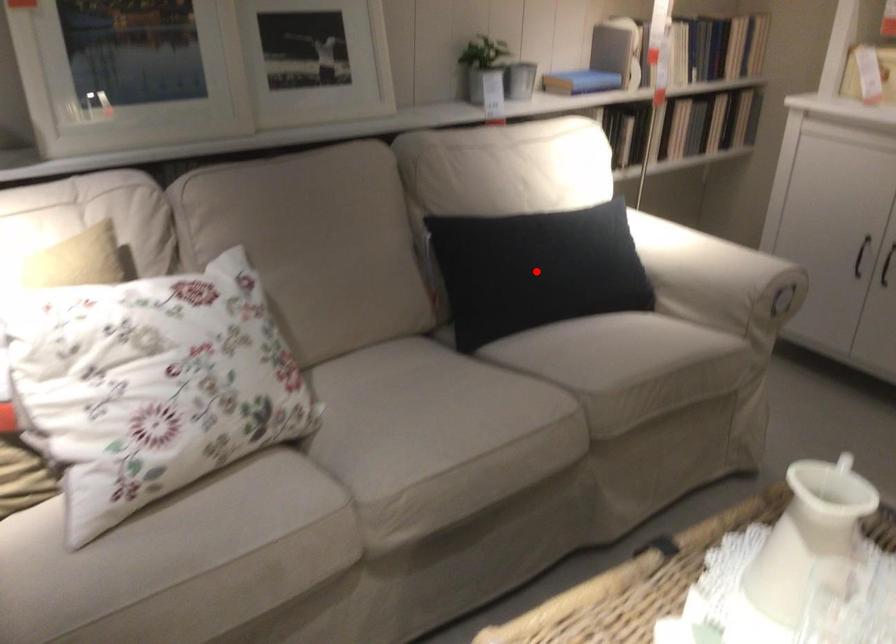
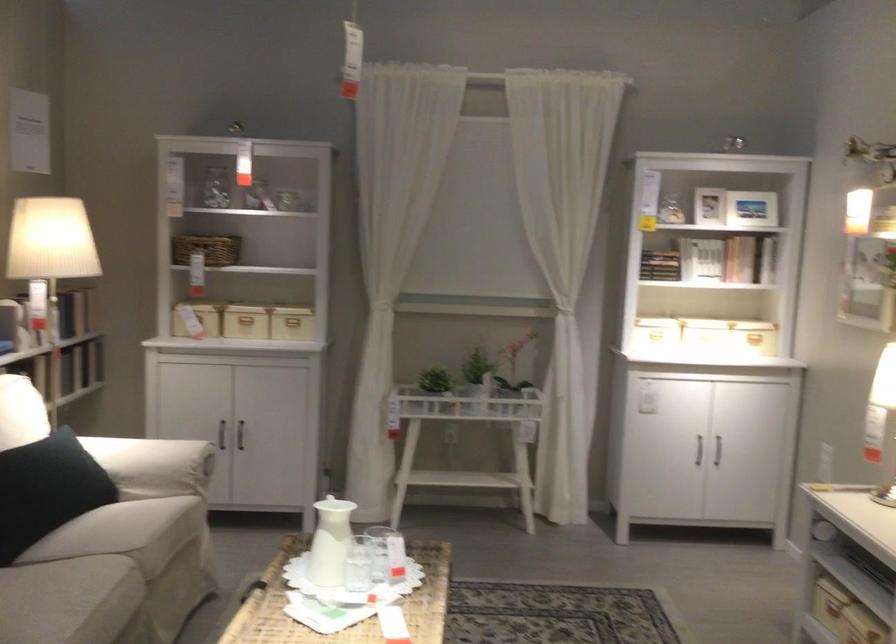
Question: I am providing you with two images of the same scene from different viewpoints. In image1, a red point is highlighted. Considering the same 3D point in image2, which of the following is correct?

Choices:
 (A) It is closer
 (B) It is farther

Answer: (B)